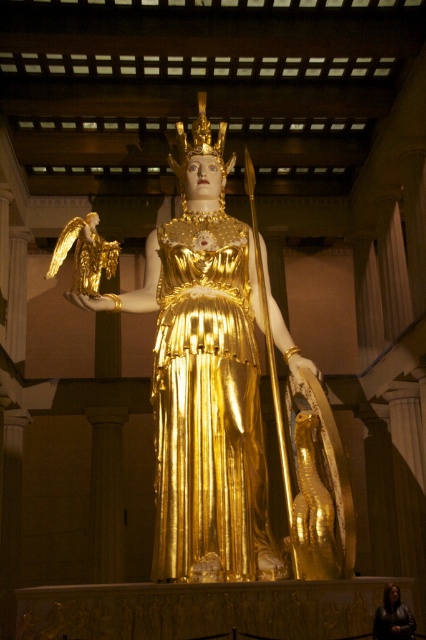
Is gold metallic statue at center to the left of gold shiny robe at center from the viewer's perspective?

Indeed, gold metallic statue at center is positioned on the left side of gold shiny robe at center.

Does point (183, 518) come in front of point (206, 456)?

Yes, it is in front of point (206, 456).

In order to click on gold metallic statue at center in this screenshot , I will do tap(204, 378).

Is gold metallic statue at center further to camera compared to dark brown leather jacket at lower right?

Yes.

Does point (201, 477) come farther from viewer compared to point (382, 596)?

Yes, it is.

What do you see at coordinates (204, 378) in the screenshot? I see `gold metallic statue at center` at bounding box center [204, 378].

The height and width of the screenshot is (640, 426). In order to click on gold metallic statue at center in this screenshot , I will do `click(204, 378)`.

Who is more forward, (235,305) or (382,621)?

Point (382,621)

Describe the element at coordinates (207, 408) in the screenshot. I see `gold shiny robe at center` at that location.

What are the coordinates of `gold shiny robe at center` in the screenshot? It's located at (x=207, y=408).